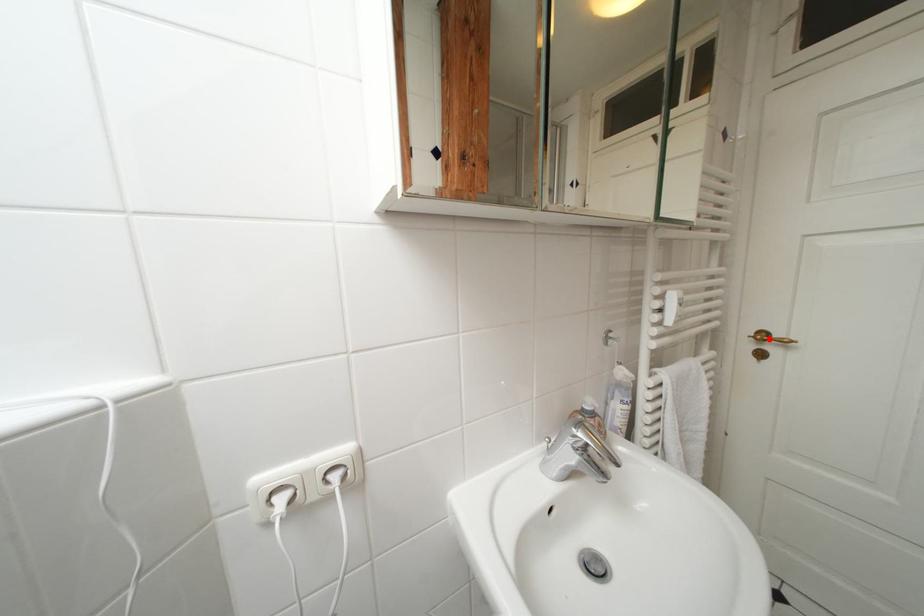
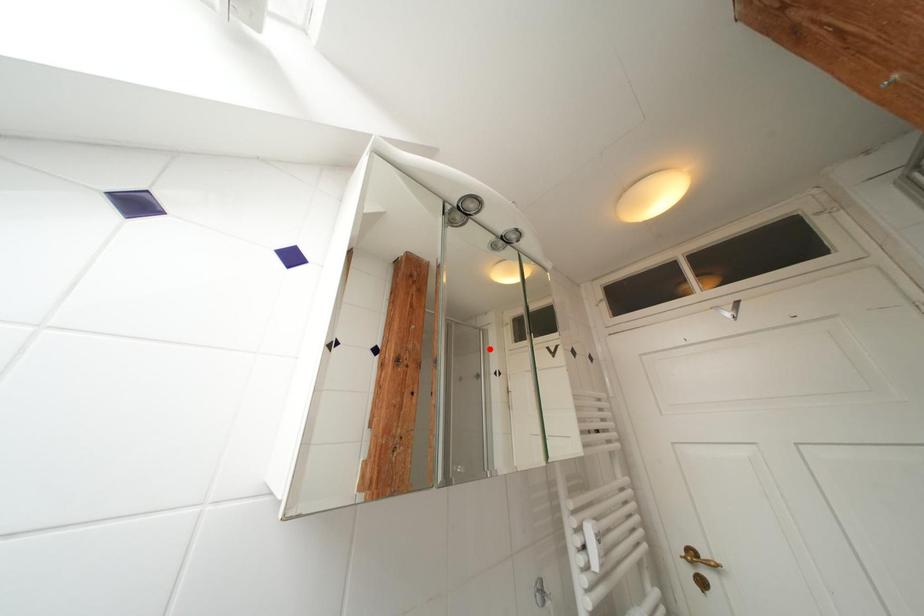
I am providing you with two images of the same scene from different viewpoints. A red point is marked on the first image and another point is marked on the second image. Does the point marked in image1 correspond to the same location as the one in image2?

No